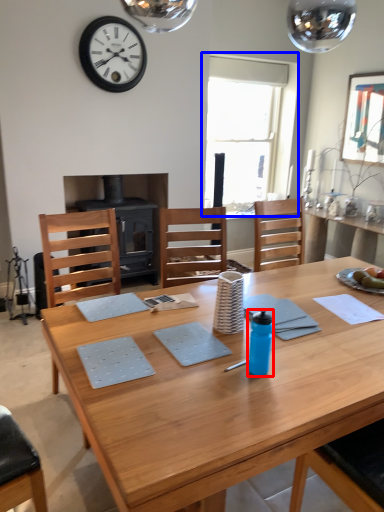
Question: Among these objects, which one is nearest to the camera, bottle (highlighted by a red box) or window (highlighted by a blue box)?

Choices:
 (A) bottle
 (B) window

Answer: (A)